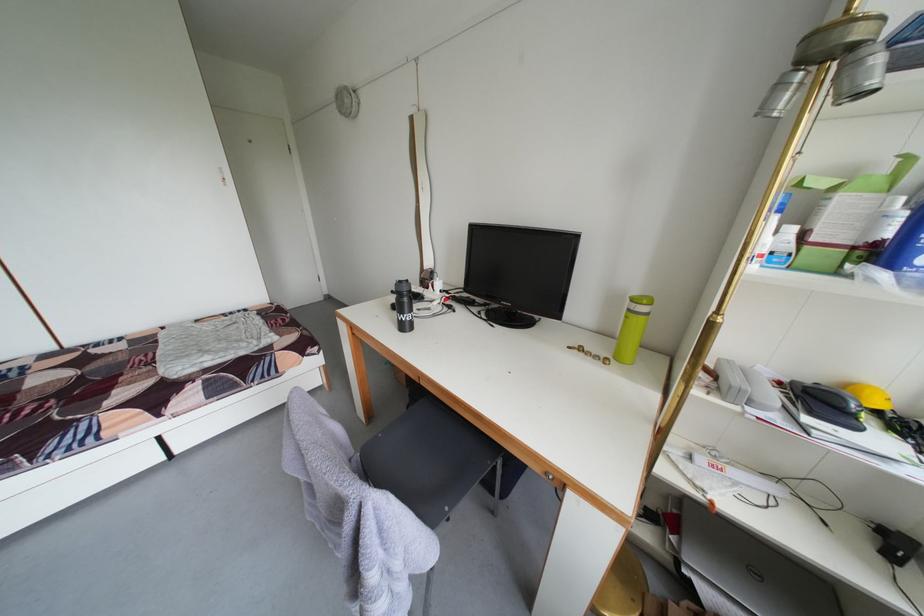
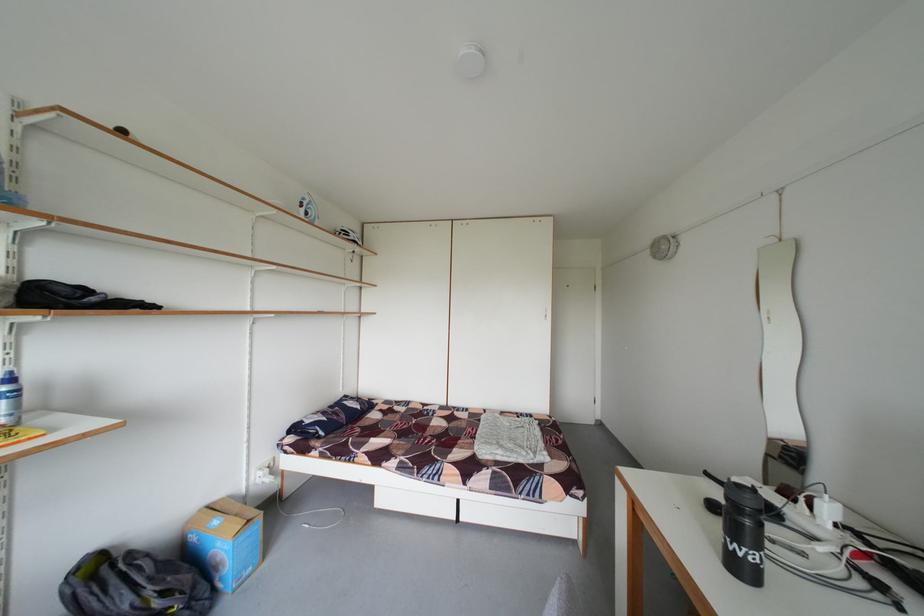
Where in the second image is the point corresponding to (358,107) from the first image?

(675, 253)